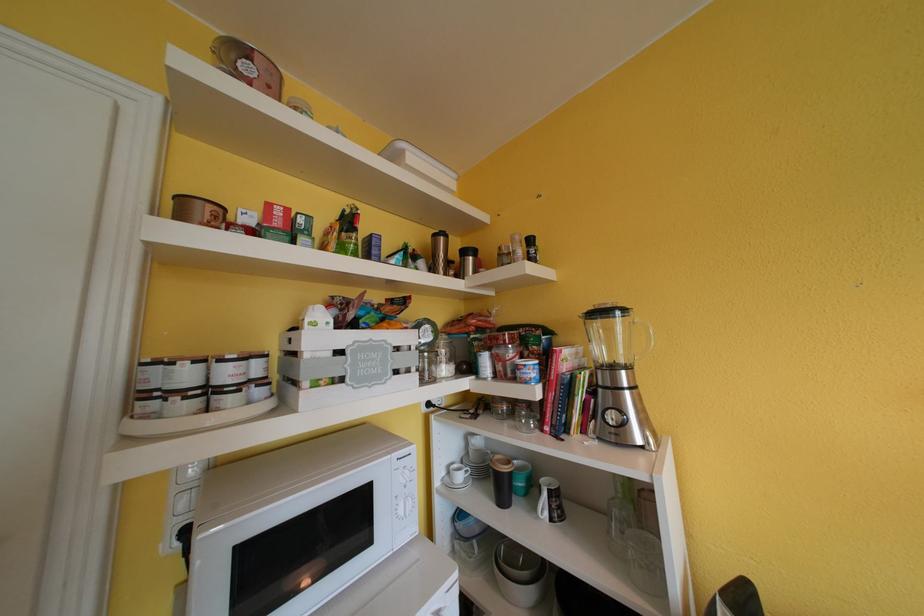
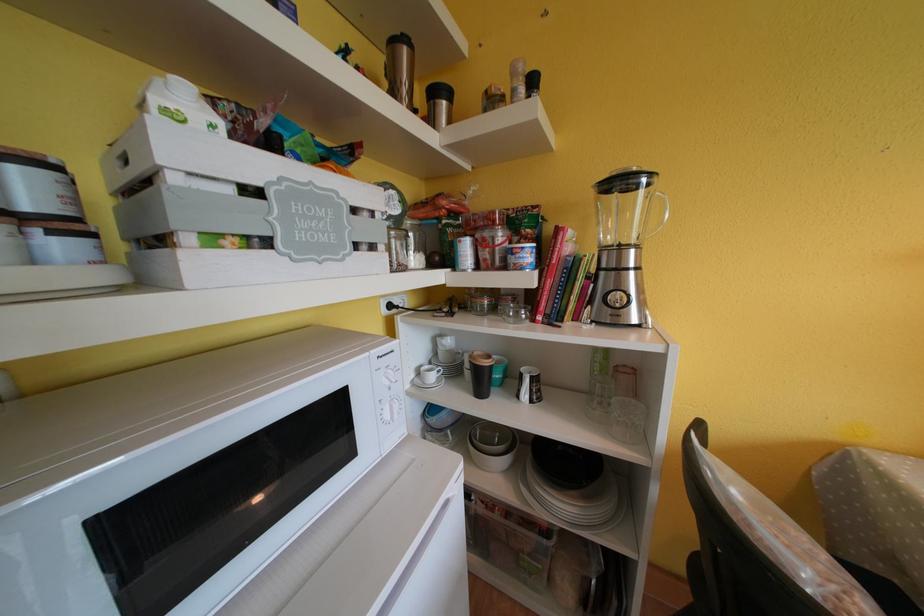
Find the pixel in the second image that matches point 531,578 in the first image.

(507, 452)